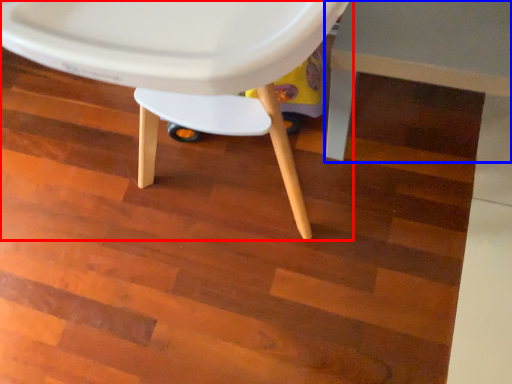
Question: Which of the following is the farthest to the observer, chair (highlighted by a red box) or table (highlighted by a blue box)?

Choices:
 (A) chair
 (B) table

Answer: (B)